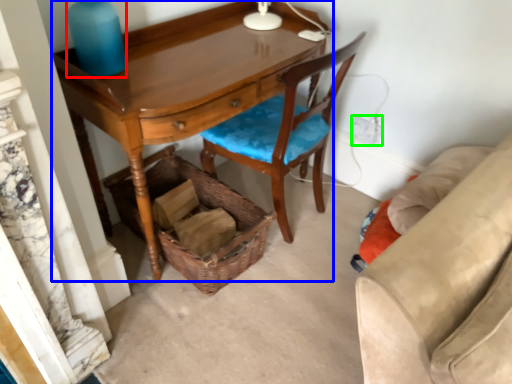
Question: Based on their relative distances, which object is farther from bottle (highlighted by a red box)? Choose from desk (highlighted by a blue box) and power outlet (highlighted by a green box).

Choices:
 (A) desk
 (B) power outlet

Answer: (B)